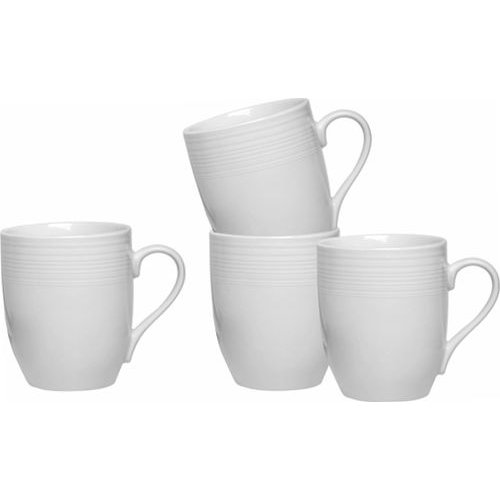
Find the location of a particular element. Image resolution: width=500 pixels, height=500 pixels. white mugs is located at coordinates tap(74, 321), tap(251, 297), tap(263, 220), tap(362, 294).